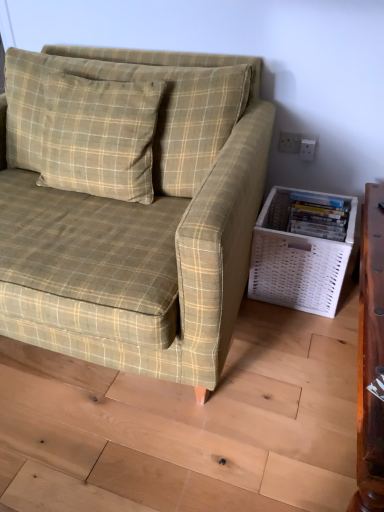
Question: Is white woven basket at lower right outside white plastic electric outlet at upper right?

Choices:
 (A) no
 (B) yes

Answer: (B)

Question: From a real-world perspective, is white woven basket at lower right physically above white plastic electric outlet at upper right?

Choices:
 (A) yes
 (B) no

Answer: (B)

Question: From the image's perspective, is white woven basket at lower right located above white plastic electric outlet at upper right?

Choices:
 (A) no
 (B) yes

Answer: (A)

Question: Is white woven basket at lower right facing away from white plastic electric outlet at upper right?

Choices:
 (A) no
 (B) yes

Answer: (A)

Question: Can you confirm if white woven basket at lower right is bigger than white plastic electric outlet at upper right?

Choices:
 (A) yes
 (B) no

Answer: (A)

Question: Considering the relative sizes of white woven basket at lower right and white plastic electric outlet at upper right in the image provided, is white woven basket at lower right shorter than white plastic electric outlet at upper right?

Choices:
 (A) no
 (B) yes

Answer: (A)

Question: Is green plaid pillow at upper left at the left side of green plaid fabric couch at center?

Choices:
 (A) no
 (B) yes

Answer: (A)

Question: Can you confirm if green plaid pillow at upper left is smaller than green plaid fabric couch at center?

Choices:
 (A) no
 (B) yes

Answer: (B)

Question: Is green plaid pillow at upper left further to camera compared to green plaid fabric couch at center?

Choices:
 (A) no
 (B) yes

Answer: (B)

Question: Is green plaid pillow at upper left surrounding green plaid fabric couch at center?

Choices:
 (A) no
 (B) yes

Answer: (A)

Question: Are green plaid pillow at upper left and green plaid fabric couch at center located far from each other?

Choices:
 (A) no
 (B) yes

Answer: (A)

Question: Does green plaid pillow at upper left have a greater height compared to green plaid fabric couch at center?

Choices:
 (A) no
 (B) yes

Answer: (A)

Question: Could you tell me if white plastic electric outlet at upper right is facing green plaid pillow at upper left?

Choices:
 (A) no
 (B) yes

Answer: (A)